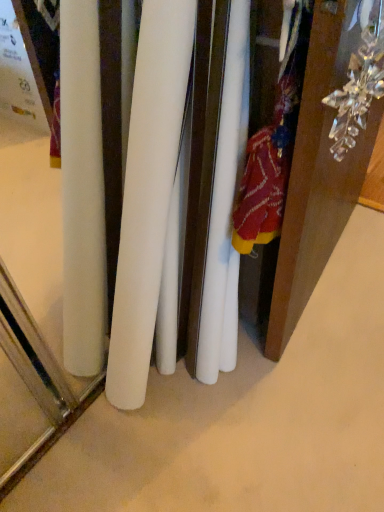
Question: Is the depth of clear crystal ornament at upper right greater than that of white matte surface at center?

Choices:
 (A) yes
 (B) no

Answer: (B)

Question: From a real-world perspective, is clear crystal ornament at upper right over white matte surface at center?

Choices:
 (A) no
 (B) yes

Answer: (B)

Question: Is clear crystal ornament at upper right smaller than white matte surface at center?

Choices:
 (A) yes
 (B) no

Answer: (A)

Question: From a real-world perspective, is clear crystal ornament at upper right beneath white matte surface at center?

Choices:
 (A) yes
 (B) no

Answer: (B)

Question: Is clear crystal ornament at upper right outside white matte surface at center?

Choices:
 (A) yes
 (B) no

Answer: (A)

Question: Considering the relative sizes of clear crystal ornament at upper right and white matte surface at center in the image provided, is clear crystal ornament at upper right bigger than white matte surface at center?

Choices:
 (A) yes
 (B) no

Answer: (B)

Question: Is white matte surface at center closer to the viewer compared to clear crystal ornament at upper right?

Choices:
 (A) yes
 (B) no

Answer: (B)

Question: Considering the relative sizes of white matte surface at center and clear crystal ornament at upper right in the image provided, is white matte surface at center bigger than clear crystal ornament at upper right?

Choices:
 (A) yes
 (B) no

Answer: (A)

Question: Is white matte surface at center with clear crystal ornament at upper right?

Choices:
 (A) no
 (B) yes

Answer: (A)

Question: Considering the relative sizes of white matte surface at center and clear crystal ornament at upper right in the image provided, is white matte surface at center shorter than clear crystal ornament at upper right?

Choices:
 (A) no
 (B) yes

Answer: (B)

Question: Does white matte surface at center appear on the right side of clear crystal ornament at upper right?

Choices:
 (A) no
 (B) yes

Answer: (A)

Question: Is white matte surface at center aimed at clear crystal ornament at upper right?

Choices:
 (A) yes
 (B) no

Answer: (B)

Question: From a real-world perspective, is white matte surface at center physically located above or below clear crystal ornament at upper right?

Choices:
 (A) above
 (B) below

Answer: (B)